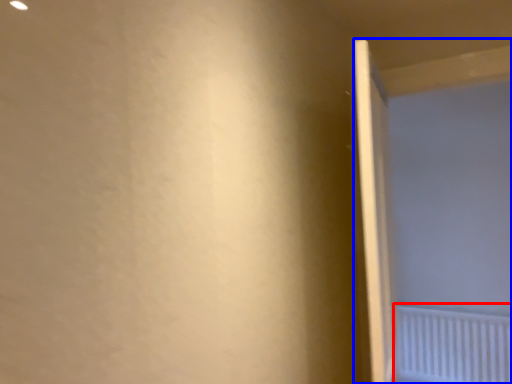
Question: Which object appears farthest to the camera in this image, radiator (highlighted by a red box) or screen door (highlighted by a blue box)?

Choices:
 (A) radiator
 (B) screen door

Answer: (A)